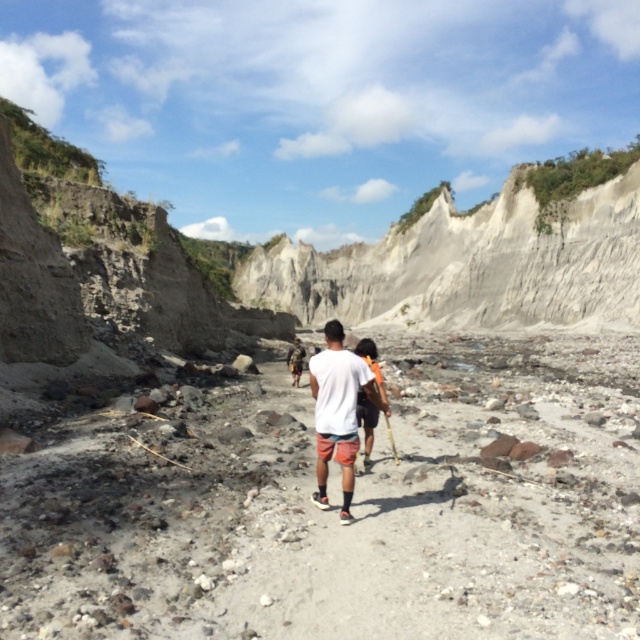
Is point (408, 465) closer to viewer compared to point (340, 422)?

No, it is not.

Does gray gravel trail at center have a lesser width compared to white matte shirt at center?

No.

Who is more distant from viewer, (272, 636) or (340, 476)?

The point (340, 476) is more distant.

The image size is (640, 640). I want to click on gray gravel trail at center, so click(x=339, y=506).